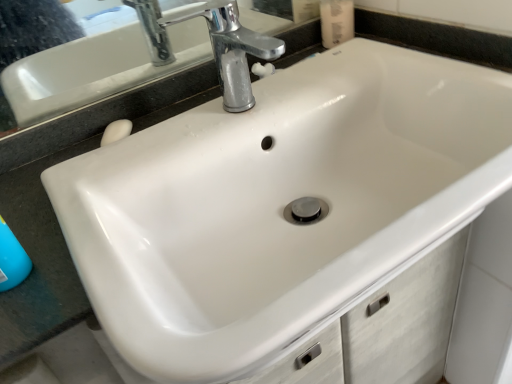
This screenshot has height=384, width=512. Identify the location of free spot in front of white matte bottle at upper right. (361, 61).